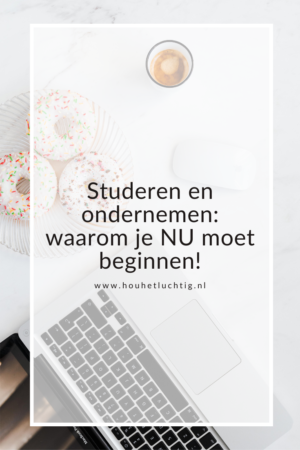
Where is `screen`? The width and height of the screenshot is (300, 450). screen is located at coordinates (45, 442).